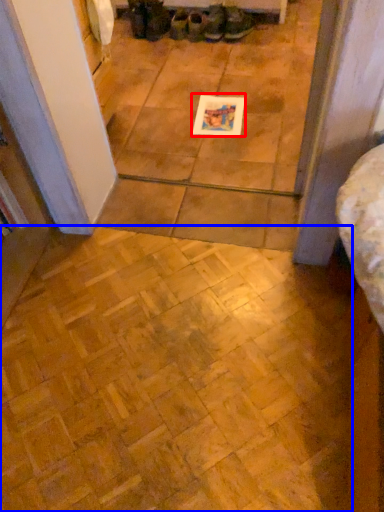
Question: Which object appears farthest to the camera in this image, postcard (highlighted by a red box) or ceramic tile (highlighted by a blue box)?

Choices:
 (A) postcard
 (B) ceramic tile

Answer: (A)